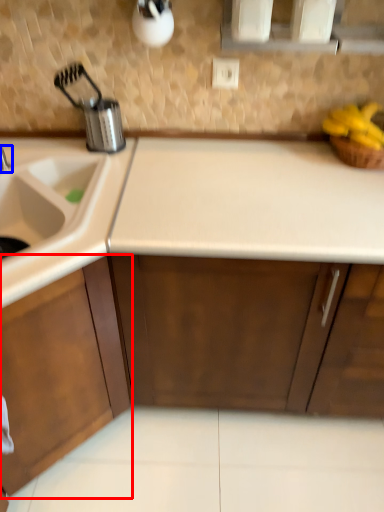
Question: Among these objects, which one is nearest to the camera, cabinetry (highlighted by a red box) or tap (highlighted by a blue box)?

Choices:
 (A) cabinetry
 (B) tap

Answer: (A)